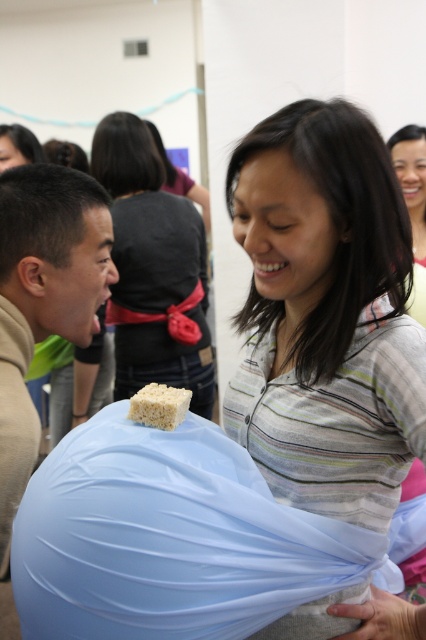
You are a guest at the event and want to know if the matte white rice cake at center is taller than the matte black hair at upper left. Can you confirm?

The matte white rice cake at center is taller than the matte black hair at upper left, so yes, it is taller.

You are a photographer at the event and need to capture a clear shot of both the striped cotton shirt at center and the matte white rice cake at center. Which object should you focus on first to ensure both are in focus?

The striped cotton shirt at center is in front of the matte white rice cake at center, so you should focus on the striped cotton shirt at center first to ensure both are in focus.